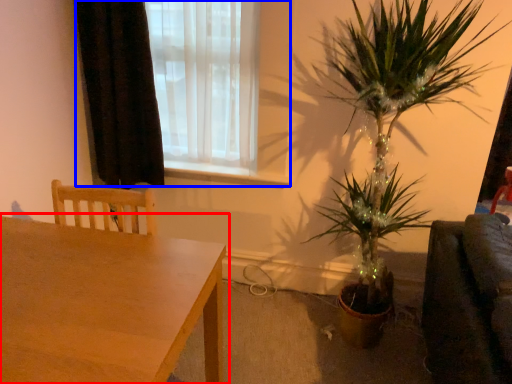
Question: Which point is closer to the camera, table (highlighted by a red box) or window (highlighted by a blue box)?

Choices:
 (A) table
 (B) window

Answer: (A)